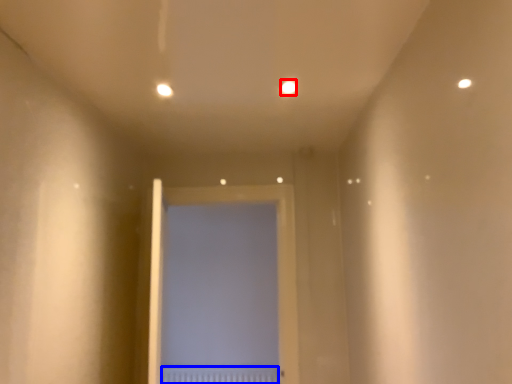
Question: Which of the following is the closest to the observer, light (highlighted by a red box) or radiator (highlighted by a blue box)?

Choices:
 (A) light
 (B) radiator

Answer: (A)